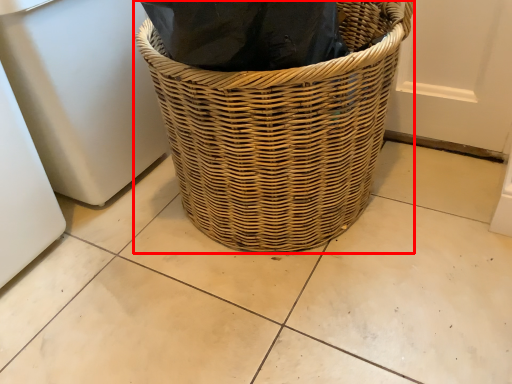
Question: From the image's perspective, where is picnic basket (annotated by the red box) located in relation to appliance in the image?

Choices:
 (A) above
 (B) below

Answer: (B)